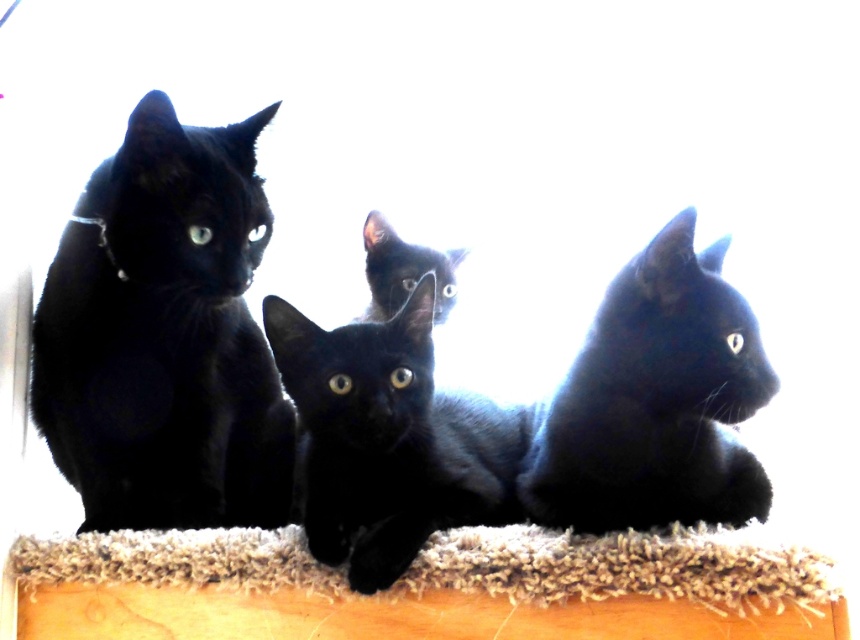
The image size is (860, 640). In order to click on shiny black kitten at center in this screenshot , I will do `click(388, 440)`.

Is shiny black kitten at center thinner than fuzzy carpet at lower center?

Yes.

At what (x,y) coordinates should I click in order to perform the action: click on shiny black kitten at center. Please return your answer as a coordinate pair (x, y). This screenshot has width=860, height=640. Looking at the image, I should click on (388, 440).

You are a GUI agent. You are given a task and a screenshot of the screen. Output one action in this format:
    pyautogui.click(x=<x>, y=<y>)
    Task: Click on the shiny black kitten at center
    
    Given the screenshot: What is the action you would take?
    pyautogui.click(x=388, y=440)

Does matte black cat at left have a larger size compared to matte black cat at center?

Correct, matte black cat at left is larger in size than matte black cat at center.

What do you see at coordinates (164, 336) in the screenshot? I see `matte black cat at left` at bounding box center [164, 336].

Locate an element on the screen. This screenshot has height=640, width=860. matte black cat at left is located at coordinates (164, 336).

Does shiny black cat at right have a larger size compared to matte black cat at center?

Correct, shiny black cat at right is larger in size than matte black cat at center.

In the scene shown: Measure the distance between shiny black cat at right and camera.

The distance of shiny black cat at right from camera is 1.15 meters.

Which is behind, point (722, 497) or point (452, 257)?

Point (452, 257)

The height and width of the screenshot is (640, 860). I want to click on shiny black cat at right, so click(656, 401).